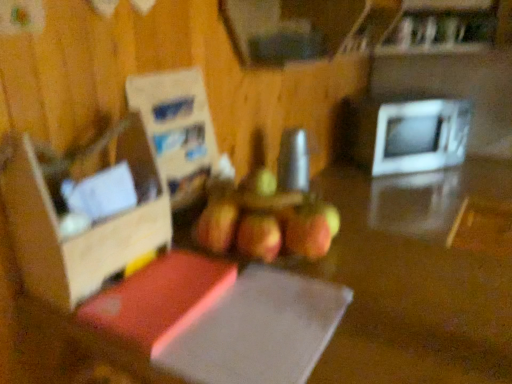
Question: From a real-world perspective, is white glossy microwave at right beneath ripe red apple at center?

Choices:
 (A) no
 (B) yes

Answer: (B)

Question: From a real-world perspective, is white glossy microwave at right physically above ripe red apple at center?

Choices:
 (A) no
 (B) yes

Answer: (A)

Question: Considering the relative sizes of white glossy microwave at right and ripe red apple at center in the image provided, is white glossy microwave at right taller than ripe red apple at center?

Choices:
 (A) no
 (B) yes

Answer: (B)

Question: Is white glossy microwave at right positioned with its back to ripe red apple at center?

Choices:
 (A) yes
 (B) no

Answer: (B)

Question: Can you confirm if white glossy microwave at right is positioned to the right of ripe red apple at center?

Choices:
 (A) no
 (B) yes

Answer: (B)

Question: Does white glossy microwave at right have a lesser width compared to ripe red apple at center?

Choices:
 (A) no
 (B) yes

Answer: (A)

Question: Is white glossy microwave at right inside ripe red apple at center?

Choices:
 (A) yes
 (B) no

Answer: (B)

Question: Is ripe red apple at center smaller than white glossy microwave at right?

Choices:
 (A) no
 (B) yes

Answer: (B)

Question: Considering the relative positions of ripe red apple at center and white glossy microwave at right in the image provided, is ripe red apple at center to the left of white glossy microwave at right from the viewer's perspective?

Choices:
 (A) yes
 (B) no

Answer: (A)

Question: Considering the relative sizes of ripe red apple at center and white glossy microwave at right in the image provided, is ripe red apple at center wider than white glossy microwave at right?

Choices:
 (A) yes
 (B) no

Answer: (B)

Question: From a real-world perspective, is ripe red apple at center under white glossy microwave at right?

Choices:
 (A) yes
 (B) no

Answer: (B)

Question: Is ripe red apple at center positioned beyond the bounds of white glossy microwave at right?

Choices:
 (A) yes
 (B) no

Answer: (A)

Question: From a real-world perspective, is cardboard box at left on white glossy microwave at right?

Choices:
 (A) no
 (B) yes

Answer: (B)